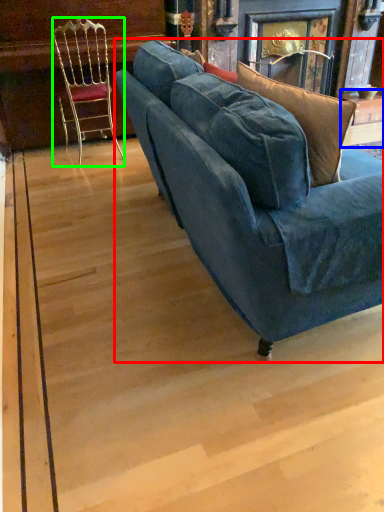
Question: Which object is positioned farthest from studio couch (highlighted by a red box)? Select from table (highlighted by a blue box) and chair (highlighted by a green box).

Choices:
 (A) table
 (B) chair

Answer: (A)